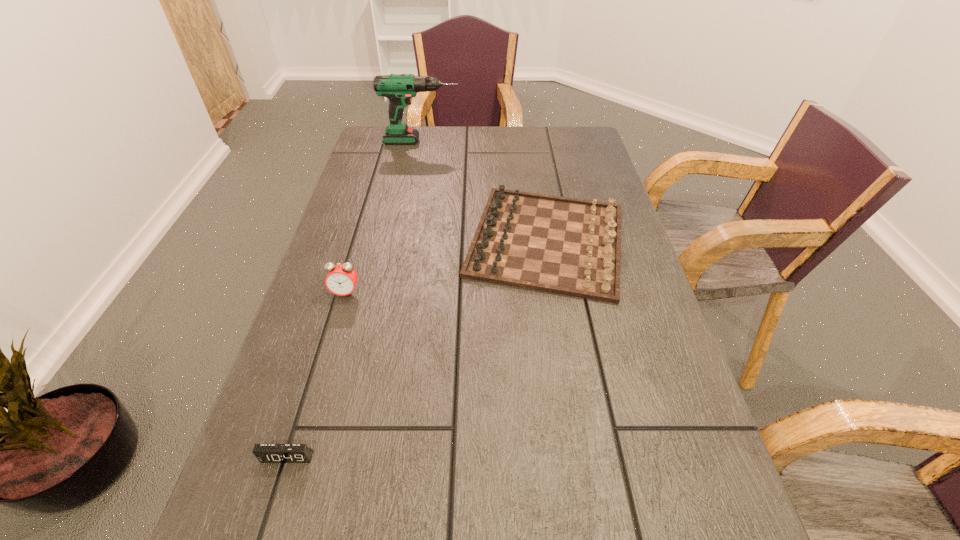
Find the location of a particular element. This screenshot has height=540, width=960. the tallest object is located at coordinates (398, 88).

The width and height of the screenshot is (960, 540). Find the location of `the farthest object`. the farthest object is located at coordinates (398, 88).

Where is `the taller alarm clock`? The height and width of the screenshot is (540, 960). the taller alarm clock is located at coordinates (341, 280).

Image resolution: width=960 pixels, height=540 pixels. Identify the location of chessboard. (567, 246).

This screenshot has width=960, height=540. Find the location of `the shorter alarm clock`. the shorter alarm clock is located at coordinates (266, 453).

Where is `the nearest object`? The height and width of the screenshot is (540, 960). the nearest object is located at coordinates (266, 453).

Find the location of `vacant area situated on the handle side of the farthest object`. vacant area situated on the handle side of the farthest object is located at coordinates (529, 141).

The image size is (960, 540). I want to click on free space located on the front-facing side of the farther alarm clock, so coord(316,394).

The height and width of the screenshot is (540, 960). I want to click on free region located 0.290m on the left of the chessboard, so click(x=347, y=240).

At what (x,y) coordinates should I click in order to perform the action: click on free space located on the front-facing side of the shorter alarm clock. Please return your answer as a coordinate pair (x, y). The image size is (960, 540). Looking at the image, I should click on (267, 524).